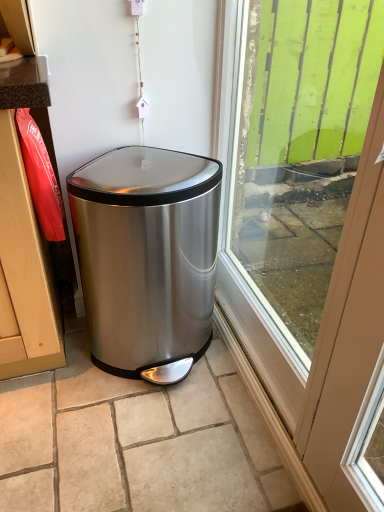
Question: From the image's perspective, is green wood at right located above or below polished stainless steel trash can at center?

Choices:
 (A) above
 (B) below

Answer: (A)

Question: In terms of width, does green wood at right look wider or thinner when compared to polished stainless steel trash can at center?

Choices:
 (A) wide
 (B) thin

Answer: (B)

Question: Visually, is green wood at right positioned to the left or to the right of polished stainless steel trash can at center?

Choices:
 (A) left
 (B) right

Answer: (B)

Question: Considering the positions of polished stainless steel trash can at center and green wood at right in the image, is polished stainless steel trash can at center taller or shorter than green wood at right?

Choices:
 (A) tall
 (B) short

Answer: (B)

Question: From a real-world perspective, is polished stainless steel trash can at center above or below green wood at right?

Choices:
 (A) above
 (B) below

Answer: (B)

Question: Is polished stainless steel trash can at center in front of or behind green wood at right in the image?

Choices:
 (A) behind
 (B) front

Answer: (A)

Question: Considering the positions of polished stainless steel trash can at center and green wood at right in the image, is polished stainless steel trash can at center wider or thinner than green wood at right?

Choices:
 (A) wide
 (B) thin

Answer: (A)